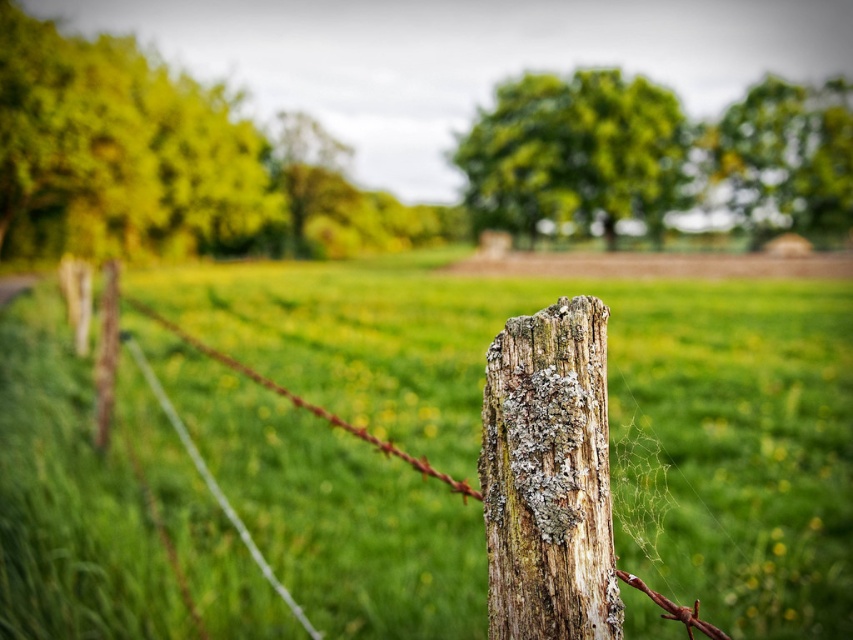
You are standing in the middle of the field and see two green leafy trees in the distance. Which tree, the green leafy tree at upper left or the green leafy tree at upper right, appears taller from your perspective?

The green leafy tree at upper left appears taller than the green leafy tree at upper right from your perspective.

You are standing in the rural landscape and want to take a photo of the silver wire at center and the green leafy tree at upper right. Which object should you adjust your camera to focus on first if you want both in the frame without moving the camera?

You should focus on the silver wire at center first because the green leafy tree at upper right is to the right of the silver wire at center, so adjusting the camera to include both would require framing from the center outward.